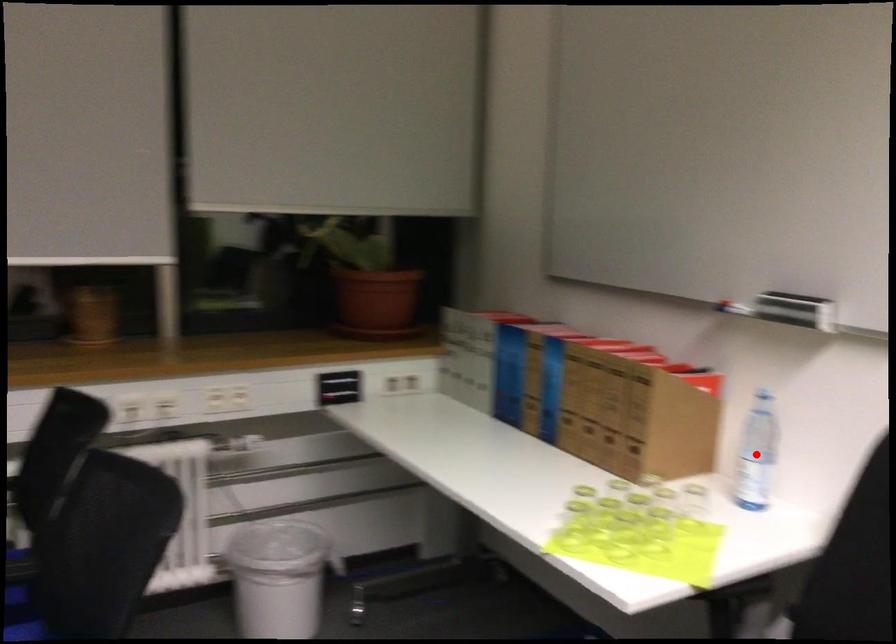
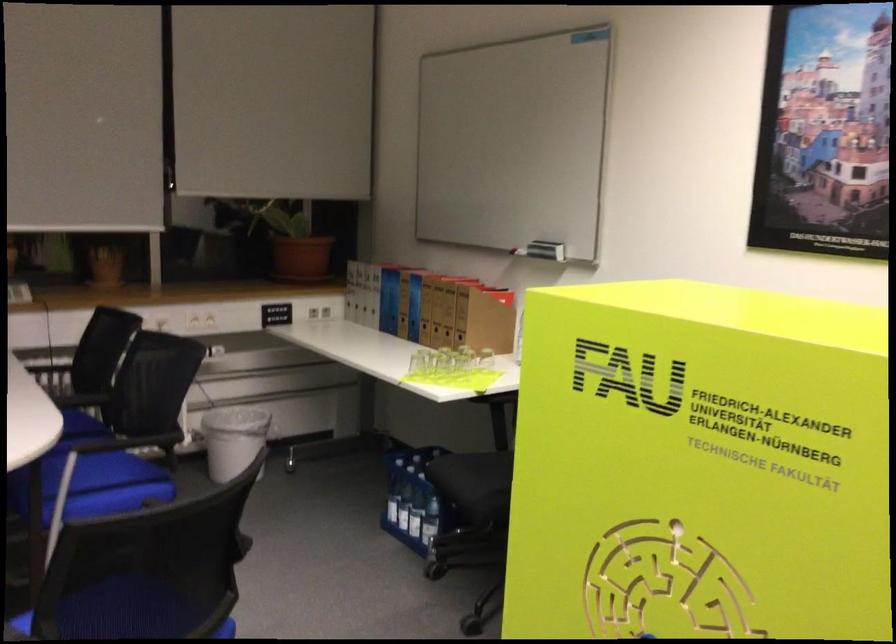
Question: I am providing you with two images of the same scene from different viewpoints. A red point is marked on the first image. Is the red point's position out of view in image 2?

Choices:
 (A) Yes
 (B) No

Answer: (A)